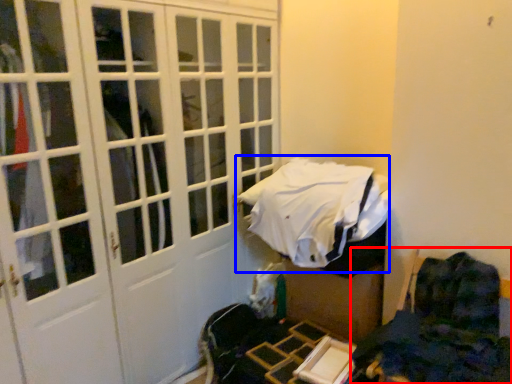
Question: Among these objects, which one is nearest to the camera, furniture (highlighted by a red box) or bed (highlighted by a blue box)?

Choices:
 (A) furniture
 (B) bed

Answer: (A)